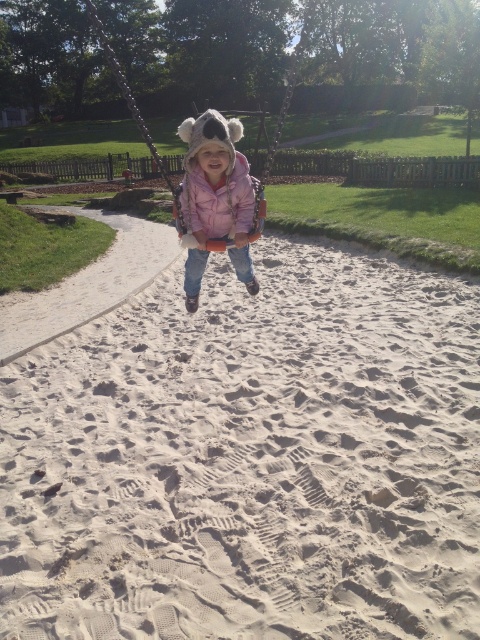
Is smooth sand at center shorter than pink fuzzy coat at center?

Yes, smooth sand at center is shorter than pink fuzzy coat at center.

I want to click on smooth sand at center, so pyautogui.click(x=251, y=460).

Who is more forward, (444,458) or (207,253)?

Point (444,458) is in front.

Image resolution: width=480 pixels, height=640 pixels. Find the location of `smooth sand at center`. smooth sand at center is located at coordinates (251, 460).

Can you confirm if smooth sand at center is positioned to the right of pink fleece jacket at center?

Indeed, smooth sand at center is positioned on the right side of pink fleece jacket at center.

Can you confirm if smooth sand at center is bigger than pink fleece jacket at center?

No.

You are a GUI agent. You are given a task and a screenshot of the screen. Output one action in this format:
    pyautogui.click(x=<x>, y=<y>)
    Task: Click on the smooth sand at center
    
    Given the screenshot: What is the action you would take?
    pyautogui.click(x=251, y=460)

Locate an element on the screen. This screenshot has width=480, height=640. smooth sand at center is located at coordinates (251, 460).

Is pink fuzzy coat at center bigger than pink fleece jacket at center?

Yes, pink fuzzy coat at center is bigger than pink fleece jacket at center.

Based on the photo, is pink fuzzy coat at center taller than pink fleece jacket at center?

Indeed, pink fuzzy coat at center has a greater height compared to pink fleece jacket at center.

Which is behind, point (240, 262) or point (192, 186)?

The point (240, 262) is behind.

You are a GUI agent. You are given a task and a screenshot of the screen. Output one action in this format:
    pyautogui.click(x=<x>, y=<y>)
    Task: Click on the pink fuzzy coat at center
    Image resolution: width=480 pixels, height=640 pixels.
    Given the screenshot: What is the action you would take?
    pyautogui.click(x=216, y=198)